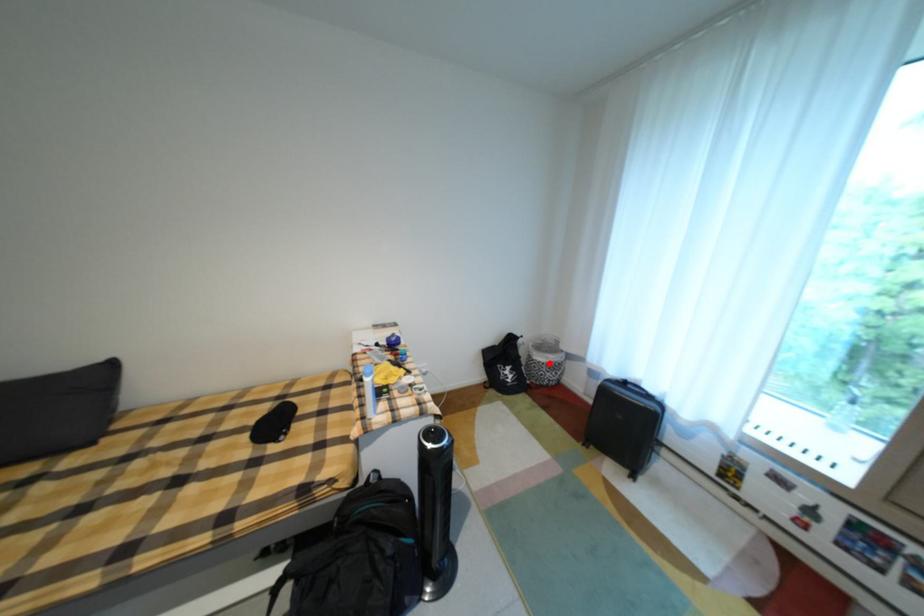
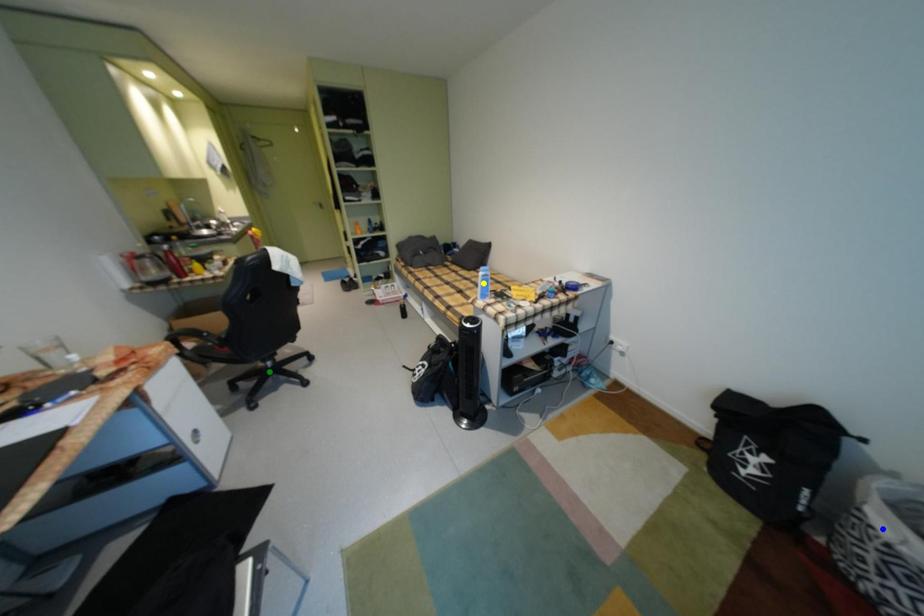
Question: I am providing you with two images of the same scene from different viewpoints. A red point is marked on the first image. You are given multiple points on the second image. In image 2, which mark is for the same physical point as the one in image 1?

Choices:
 (A) blue point
 (B) green point
 (C) yellow point

Answer: (A)